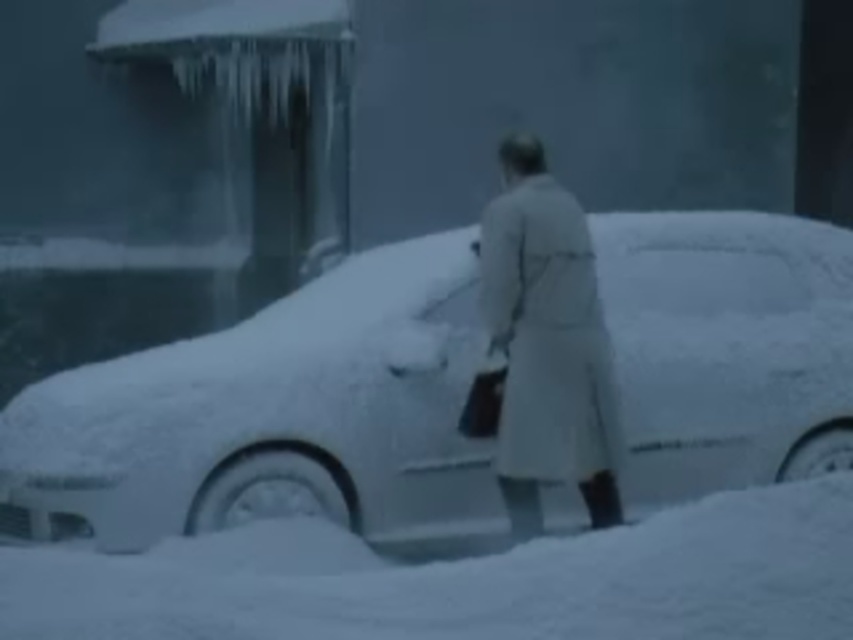
Who is positioned more to the left, white fluffy snow at lower center or light beige coat at center?

white fluffy snow at lower center

Consider the image. Which of these two, white fluffy snow at lower center or light beige coat at center, stands shorter?

With less height is white fluffy snow at lower center.

Is point (706, 605) closer to camera compared to point (596, 323)?

That is True.

Where is `white fluffy snow at lower center`? Image resolution: width=853 pixels, height=640 pixels. white fluffy snow at lower center is located at coordinates (465, 579).

Which is more to the right, white matte car at center or light beige coat at center?

light beige coat at center

Is point (102, 365) more distant than point (569, 365)?

Yes, point (102, 365) is farther from viewer.

Locate an element on the screen. The width and height of the screenshot is (853, 640). white matte car at center is located at coordinates (271, 417).

Who is shorter, white matte car at center or white fluffy snow at lower center?

white fluffy snow at lower center

Does point (86, 384) come farther from viewer compared to point (410, 605)?

Yes, point (86, 384) is farther from viewer.

Between point (695, 349) and point (54, 630), which one is positioned in front?

Point (54, 630) is in front.

Identify the location of white matte car at center. Image resolution: width=853 pixels, height=640 pixels. (271, 417).